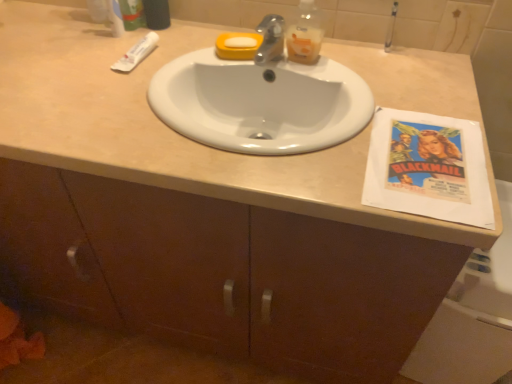
This screenshot has width=512, height=384. I want to click on unoccupied space behind white matte tube at upper left, so click(x=154, y=34).